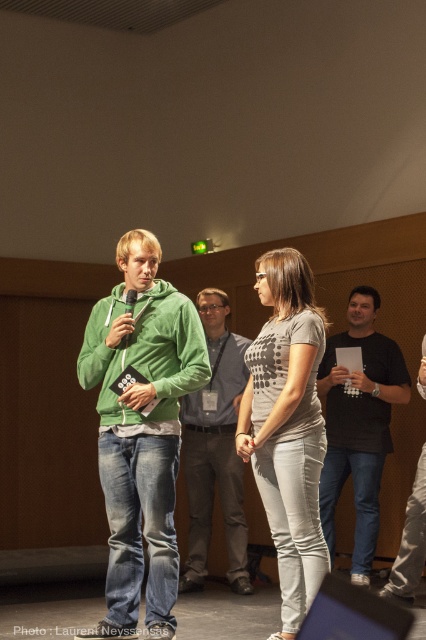
Does green fabric shirt at center have a smaller size compared to black matte shirt at right?

No, green fabric shirt at center is not smaller than black matte shirt at right.

The image size is (426, 640). What do you see at coordinates (215, 449) in the screenshot?
I see `green fabric shirt at center` at bounding box center [215, 449].

In order to click on green fabric shirt at center in this screenshot , I will do `click(215, 449)`.

Between green fleece hoodie at center and green fabric shirt at center, which one is positioned higher?

Positioned higher is green fleece hoodie at center.

Where is `green fleece hoodie at center`? The height and width of the screenshot is (640, 426). green fleece hoodie at center is located at coordinates (141, 429).

Does black matte shirt at center appear on the left side of black matte shirt at right?

Yes, black matte shirt at center is to the left of black matte shirt at right.

Does black matte shirt at center have a lesser height compared to black matte shirt at right?

In fact, black matte shirt at center may be taller than black matte shirt at right.

Between point (333, 433) and point (414, 525), which one is positioned behind?

Point (333, 433)

Locate an element on the screen. black matte shirt at center is located at coordinates (359, 422).